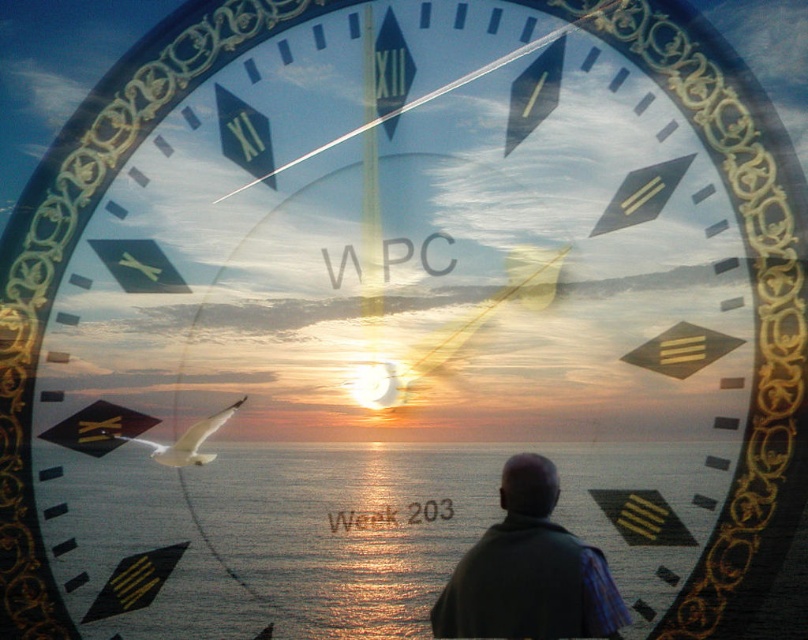
Question: Estimate the real-world distances between objects in this image. Which object is closer to the glistening ocean water at center?

Choices:
 (A) white feathered bird at center
 (B) dark gray fabric at center

Answer: (B)

Question: Among these objects, which one is farthest from the camera?

Choices:
 (A) glistening ocean water at center
 (B) white feathered bird at center

Answer: (B)

Question: Where is glistening ocean water at center located in relation to dark gray fabric at center in the image?

Choices:
 (A) left
 (B) right

Answer: (A)

Question: Which point appears closest to the camera in this image?

Choices:
 (A) (421, 513)
 (B) (520, 628)

Answer: (B)

Question: Does dark gray fabric at center have a smaller size compared to white feathered bird at center?

Choices:
 (A) no
 (B) yes

Answer: (A)

Question: From the image, what is the correct spatial relationship of glistening ocean water at center in relation to white feathered bird at center?

Choices:
 (A) left
 (B) right

Answer: (B)